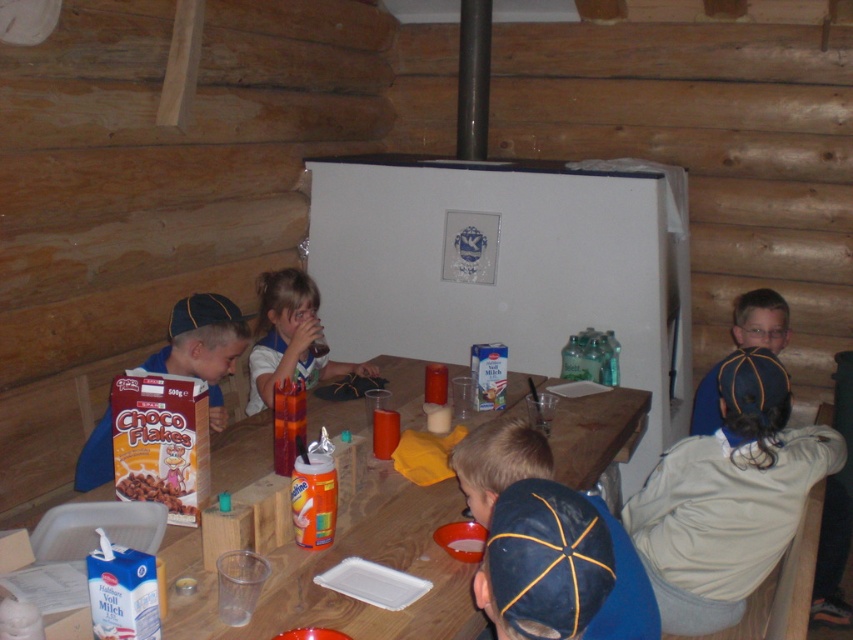
Can you confirm if matte plastic cup at center is smaller than matte blue cap at lower right?

No.

Does matte plastic cup at center have a lesser height compared to matte blue cap at lower right?

No, matte plastic cup at center is not shorter than matte blue cap at lower right.

Who is more forward, (332, 362) or (775, 324)?

Point (775, 324)

Where is `matte plastic cup at center`? matte plastic cup at center is located at coordinates (289, 337).

Can you confirm if light beige jacket at lower right is taller than matte cardboard cereal box at center left?

Yes, light beige jacket at lower right is taller than matte cardboard cereal box at center left.

Which is more to the right, light beige jacket at lower right or matte cardboard cereal box at center left?

From the viewer's perspective, light beige jacket at lower right appears more on the right side.

Find the location of a particular element. This screenshot has height=640, width=853. light beige jacket at lower right is located at coordinates (728, 499).

Between matte cardboard cereal box at lower left and matte plastic cup at center, which one is positioned lower?

matte cardboard cereal box at lower left is below.

Who is more distant from viewer, (109, 433) or (276, 344)?

Positioned behind is point (276, 344).

I want to click on matte cardboard cereal box at lower left, so click(x=202, y=346).

Where is `matte cardboard cereal box at lower left`? The height and width of the screenshot is (640, 853). matte cardboard cereal box at lower left is located at coordinates (202, 346).